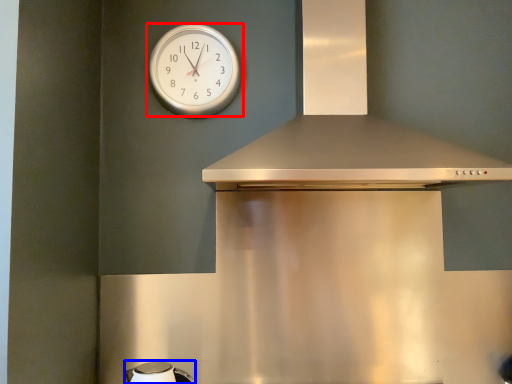
Question: Which of the following is the closest to the observer, wall clock (highlighted by a red box) or appliance (highlighted by a blue box)?

Choices:
 (A) wall clock
 (B) appliance

Answer: (B)